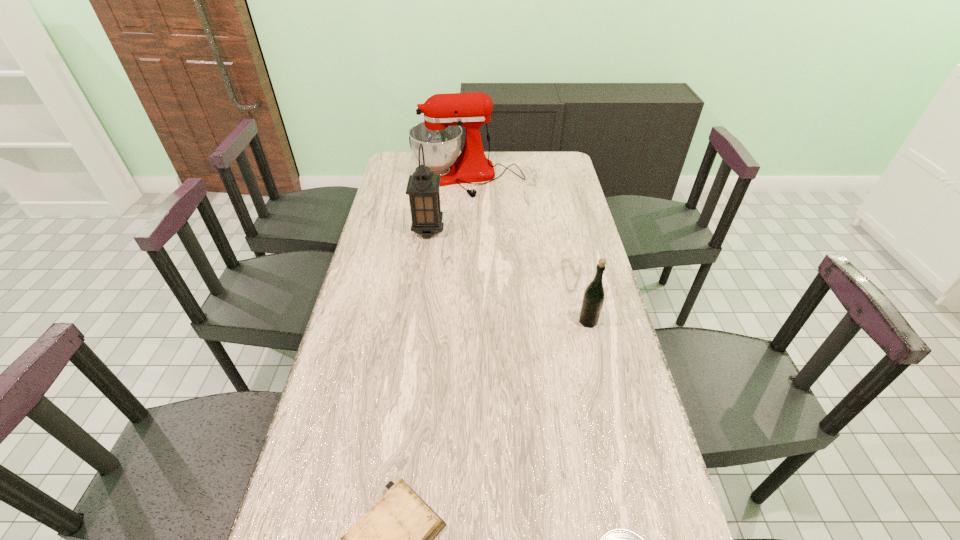
Where is `the closest object to the lantern`? This screenshot has width=960, height=540. the closest object to the lantern is located at coordinates (440, 133).